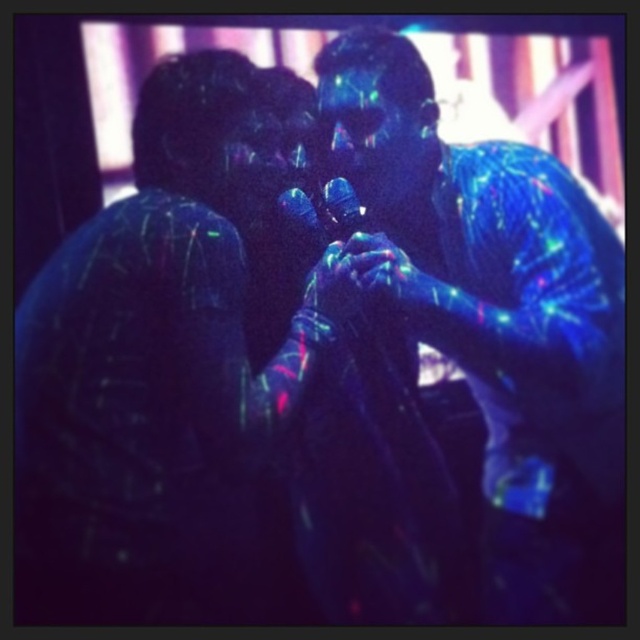
You are a photographer setting up for a neon art photoshoot. You have two neon blue elements in the frame, the neon blue skin at center and the neon blue fabric at center. To ensure both elements are in focus, what is the minimum distance your camera lens should be set to?

The minimum distance your camera lens should be set to is 11.63 inches, as this is the distance between the neon blue skin at center and the neon blue fabric at center to ensure both are in focus.

You are a sound technician at a neon lit event. You need to choose a microphone that can fit into a small handheld device holder. Which microphone, the translucent plastic microphone at center or the metallic blue microphone at center, is more suitable?

The translucent plastic microphone at center has a smaller size compared to the metallic blue microphone at center, making it more suitable for the small handheld device holder.

You are a photographer at a neon art exhibition. You need to take a photo of the neon blue skin at center and the metallic blue microphone at center. Which object should you focus on first if you want to capture both in the same frame without moving the camera?

The neon blue skin at center is below the metallic blue microphone at center, so you should focus on the metallic blue microphone at center first to ensure both objects are in the frame.